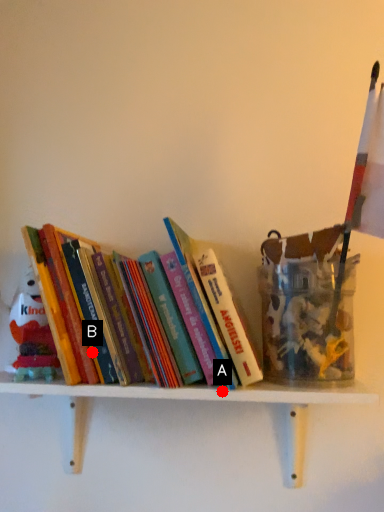
Question: Two points are circled on the image, labeled by A and B beside each circle. Which point appears closest to the camera in this image?

Choices:
 (A) A is closer
 (B) B is closer

Answer: (A)